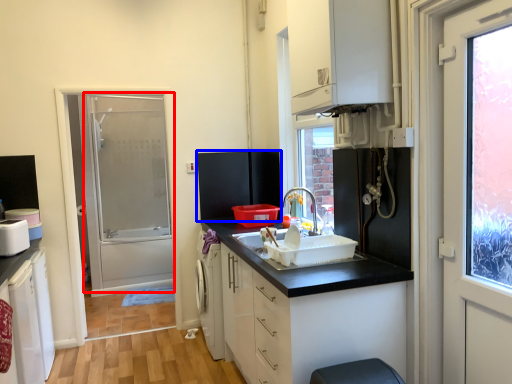
Question: Which of the following is the closest to the observer, screen door (highlighted by a red box) or appliance (highlighted by a blue box)?

Choices:
 (A) screen door
 (B) appliance

Answer: (A)